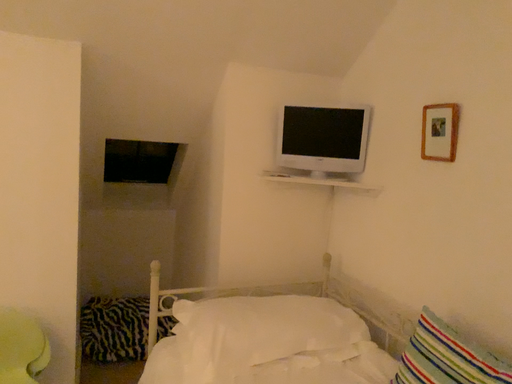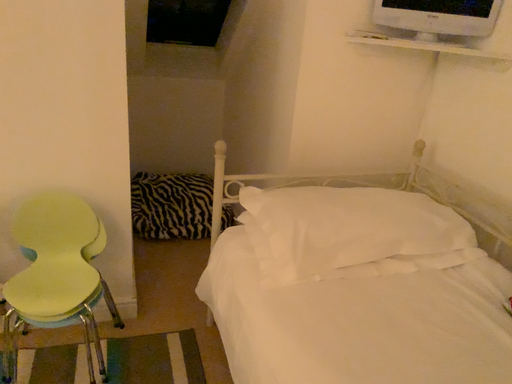
Question: Which way did the camera rotate in the video?

Choices:
 (A) rotated upward
 (B) rotated downward

Answer: (B)